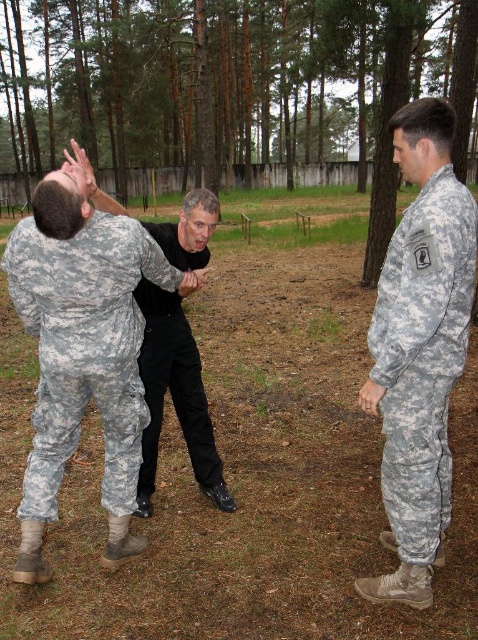
You are a photographer positioned in the wooded area and want to capture a photo of both the black matte pants at center and the black matte hand at center. Which object should you focus on first if you want to ensure both are in sharp focus?

You should focus on the black matte pants at center first because it is taller than the black matte hand at center, so focusing on the closer object might help both be in focus.

You are a drone operator observing the training exercise. You need to determine which of the two points, point (75, 417) or point (156, 292), is nearer to your vantage point. Based on the spatial relationship between these points, which one is closer?

Point (75, 417) is closer to the viewer than point (156, 292).

You are a drone operator controlling a drone that needs to hover directly above the camouflage fabric uniform at right. What coordinates should you input into the drone to ensure it hovers precisely above this target?

The coordinates to input into the drone are 0.558 on the x axis and 0.885 on the y axis, as the camouflage fabric uniform at right is located at point (423, 356).